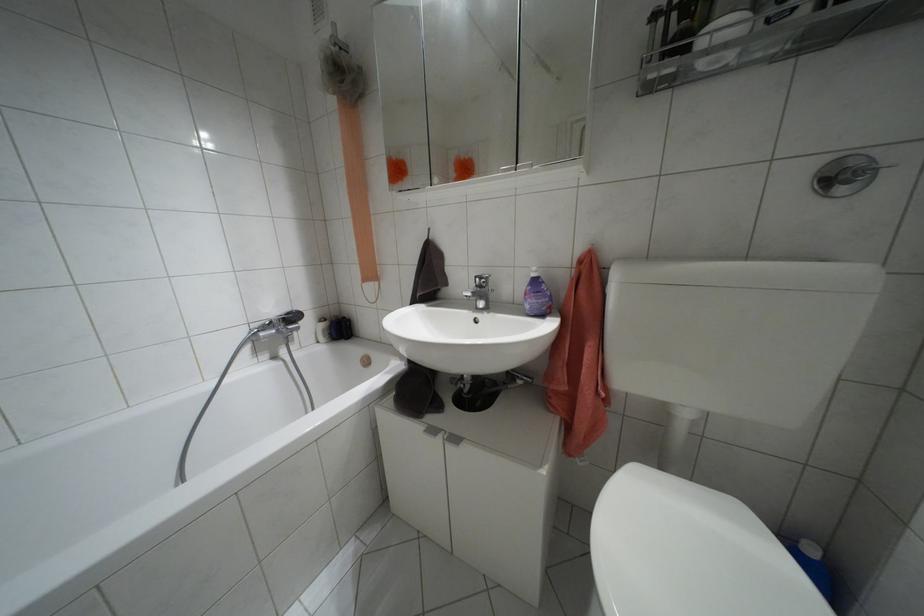
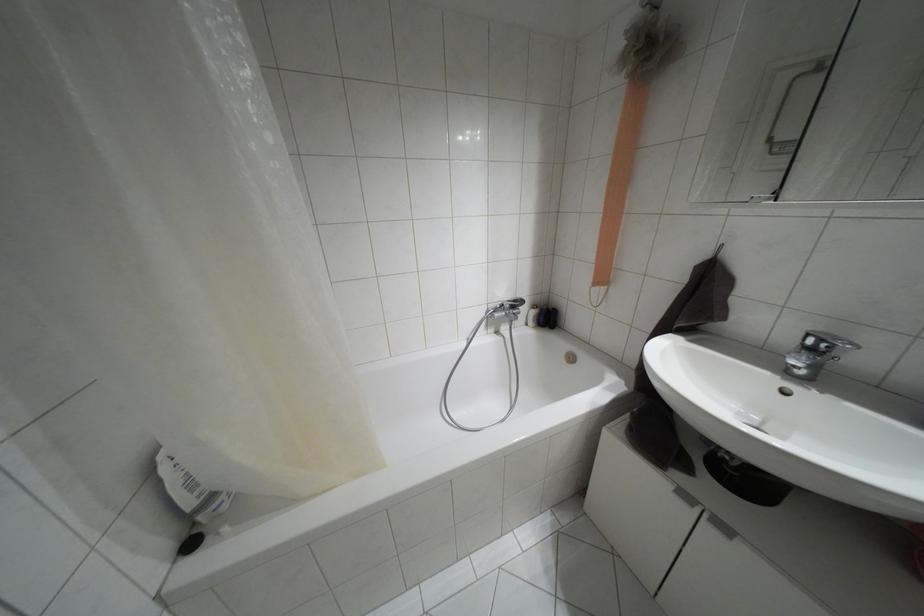
Locate, in the second image, the point that corresponds to point (432, 430) in the first image.

(685, 496)